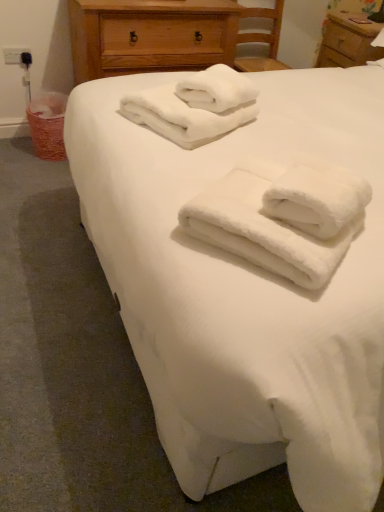
Identify the location of white soft towels at upper center, the first towel when ordered from top to bottom. (183, 117).

Image resolution: width=384 pixels, height=512 pixels. Describe the element at coordinates (17, 56) in the screenshot. I see `black plastic outlet at upper left` at that location.

Describe the element at coordinates (348, 40) in the screenshot. The image size is (384, 512). I see `wooden nightstand at upper right` at that location.

At what (x,y) coordinates should I click in order to perform the action: click on white soft towels at upper center, which appears as the first towel when viewed from the back. Please return your answer as a coordinate pair (x, y). Image resolution: width=384 pixels, height=512 pixels. Looking at the image, I should click on (183, 117).

Based on their positions, is white fluffy towels at center, which ranks as the 1th towel in front-to-back order, located to the left or right of white soft bed at center?

From the image, it's evident that white fluffy towels at center, which ranks as the 1th towel in front-to-back order, is to the left of white soft bed at center.

Is white fluffy towels at center, placed as the 1th towel when sorted from bottom to top, further to the viewer compared to white soft bed at center?

Yes, white fluffy towels at center, placed as the 1th towel when sorted from bottom to top, is further from the camera.

In terms of height, does white fluffy towels at center, which ranks as the second towel in top-to-bottom order, look taller or shorter compared to white soft bed at center?

white fluffy towels at center, which ranks as the second towel in top-to-bottom order, is shorter than white soft bed at center.

The height and width of the screenshot is (512, 384). I want to click on bed located in front of the white fluffy towels at center, placed as the 1th towel when sorted from bottom to top, so click(244, 291).

What's the angular difference between black plastic outlet at upper left and wooden chest of drawers at upper center's facing directions?

1.42 degrees separate the facing orientations of black plastic outlet at upper left and wooden chest of drawers at upper center.

Which is in front, black plastic outlet at upper left or wooden chest of drawers at upper center?

wooden chest of drawers at upper center is in front.

Which is nearer, (6,50) or (222,61)?

Point (6,50) appears to be farther away from the viewer than point (222,61).

Is black plastic outlet at upper left facing towards wooden chest of drawers at upper center?

No, black plastic outlet at upper left is not oriented towards wooden chest of drawers at upper center.

Considering the relative sizes of white fluffy towels at center, which ranks as the second towel in back-to-front order, and black plastic outlet at upper left in the image provided, is white fluffy towels at center, which ranks as the second towel in back-to-front order, bigger than black plastic outlet at upper left?

Yes, white fluffy towels at center, which ranks as the second towel in back-to-front order, is bigger than black plastic outlet at upper left.

Is black plastic outlet at upper left at the back of white fluffy towels at center, which ranks as the 1th towel in front-to-back order?

No, white fluffy towels at center, which ranks as the 1th towel in front-to-back order, is not facing the opposite direction of black plastic outlet at upper left.

From a real-world perspective, is white fluffy towels at center, which ranks as the second towel in top-to-bottom order, beneath black plastic outlet at upper left?

No, from a real-world perspective, white fluffy towels at center, which ranks as the second towel in top-to-bottom order, is not under black plastic outlet at upper left.

Is black plastic outlet at upper left at the left side of white soft towels at upper center, the first towel when ordered from top to bottom?

Yes, black plastic outlet at upper left is to the left of white soft towels at upper center, the first towel when ordered from top to bottom.

Is black plastic outlet at upper left with white soft towels at upper center, which ranks as the 2th towel in front-to-back order?

No, black plastic outlet at upper left is not touching white soft towels at upper center, which ranks as the 2th towel in front-to-back order.

How different are the orientations of black plastic outlet at upper left and white soft towels at upper center, which ranks as the 2th towel in front-to-back order, in degrees?

There is a 63.9-degree angle between the facing directions of black plastic outlet at upper left and white soft towels at upper center, which ranks as the 2th towel in front-to-back order.

Identify the location of electric outlet located on the left of white soft towels at upper center, which appears as the first towel when viewed from the back. Image resolution: width=384 pixels, height=512 pixels. (x=17, y=56).

Would you consider white fluffy towels at center, which ranks as the 1th towel in front-to-back order, to be distant from wooden chest of drawers at upper center?

Yes, white fluffy towels at center, which ranks as the 1th towel in front-to-back order, and wooden chest of drawers at upper center are quite far apart.

Who is taller, white fluffy towels at center, which ranks as the second towel in back-to-front order, or wooden chest of drawers at upper center?

wooden chest of drawers at upper center.

Can you tell me how much white fluffy towels at center, placed as the 1th towel when sorted from bottom to top, and wooden chest of drawers at upper center differ in facing direction?

The facing directions of white fluffy towels at center, placed as the 1th towel when sorted from bottom to top, and wooden chest of drawers at upper center are 53.7 degrees apart.

From a real-world perspective, is white fluffy towels at center, which ranks as the second towel in back-to-front order, located higher than wooden chest of drawers at upper center?

Correct, in the physical world, white fluffy towels at center, which ranks as the second towel in back-to-front order, is higher than wooden chest of drawers at upper center.

Is white soft bed at center beside wooden nightstand at upper right?

No, white soft bed at center is not beside wooden nightstand at upper right.

From a real-world perspective, is white soft bed at center under wooden nightstand at upper right?

Yes, from a real-world perspective, white soft bed at center is below wooden nightstand at upper right.

Looking at this image, which of these two, white soft bed at center or wooden nightstand at upper right, is thinner?

wooden nightstand at upper right is thinner.

From the image's perspective, relative to wooden nightstand at upper right, is white soft bed at center above or below?

white soft bed at center is below wooden nightstand at upper right.

Is the position of wooden chest of drawers at upper center less distant than that of black plastic outlet at upper left?

Yes, wooden chest of drawers at upper center is closer to the viewer.

Which of these two, wooden chest of drawers at upper center or black plastic outlet at upper left, stands taller?

Standing taller between the two is wooden chest of drawers at upper center.

Is black plastic outlet at upper left located within wooden chest of drawers at upper center?

No, black plastic outlet at upper left is not a part of wooden chest of drawers at upper center.

From the image's perspective, does wooden chest of drawers at upper center appear higher than black plastic outlet at upper left?

Correct, wooden chest of drawers at upper center appears higher than black plastic outlet at upper left in the image.

Locate an element on the screen. the 1st towel to the left when counting from the white soft bed at center is located at coordinates (263, 228).

Locate an element on the screen. the chest of drawers above the black plastic outlet at upper left (from a real-world perspective) is located at coordinates (150, 36).

Considering their positions, is white soft towels at upper center, which ranks as the 2th towel in front-to-back order, positioned closer to wooden nightstand at upper right than white soft bed at center?

white soft bed at center lies closer to wooden nightstand at upper right than the other object.

Estimate the real-world distances between objects in this image. Which object is further from white fluffy towels at center, which ranks as the 1th towel in front-to-back order, wooden nightstand at upper right or white soft bed at center?

wooden nightstand at upper right is positioned further to the anchor white fluffy towels at center, which ranks as the 1th towel in front-to-back order.

Estimate the real-world distances between objects in this image. Which object is further from wooden nightstand at upper right, black plastic outlet at upper left or white soft towels at upper center, which appears as the first towel when viewed from the back?

black plastic outlet at upper left is further to wooden nightstand at upper right.

In the scene shown: From the image, which object appears to be farther from white fluffy towels at center, which ranks as the 1th towel in front-to-back order, black plastic outlet at upper left or white soft towels at upper center, which ranks as the 2th towel in front-to-back order?

black plastic outlet at upper left.

Considering their positions, is wooden nightstand at upper right positioned closer to white fluffy towels at center, which ranks as the second towel in top-to-bottom order, than white soft towels at upper center, which appears as the first towel when viewed from the back?

Based on the image, white soft towels at upper center, which appears as the first towel when viewed from the back, appears to be nearer to white fluffy towels at center, which ranks as the second towel in top-to-bottom order.

Based on their spatial positions, is white soft bed at center or wooden nightstand at upper right closer to white fluffy towels at center, placed as the 1th towel when sorted from bottom to top?

Among the two, white soft bed at center is located nearer to white fluffy towels at center, placed as the 1th towel when sorted from bottom to top.

Looking at the image, which one is located further to wooden nightstand at upper right, white fluffy towels at center, which ranks as the second towel in top-to-bottom order, or black plastic outlet at upper left?

white fluffy towels at center, which ranks as the second towel in top-to-bottom order, is positioned further to the anchor wooden nightstand at upper right.

Which object lies nearer to the anchor point white soft towels at upper center, the first towel when ordered from top to bottom, wooden chest of drawers at upper center or white fluffy towels at center, which ranks as the second towel in back-to-front order?

Among the two, white fluffy towels at center, which ranks as the second towel in back-to-front order, is located nearer to white soft towels at upper center, the first towel when ordered from top to bottom.

Find the location of a particular element. This screenshot has height=512, width=384. towel located between white fluffy towels at center, placed as the 1th towel when sorted from bottom to top, and wooden nightstand at upper right in the depth direction is located at coordinates (183, 117).

Locate an element on the screen. The image size is (384, 512). towel between white fluffy towels at center, which ranks as the second towel in top-to-bottom order, and black plastic outlet at upper left, along the z-axis is located at coordinates (183, 117).

The image size is (384, 512). Find the location of `chest of drawers between white fluffy towels at center, which ranks as the 1th towel in front-to-back order, and black plastic outlet at upper left in the front-back direction`. chest of drawers between white fluffy towels at center, which ranks as the 1th towel in front-to-back order, and black plastic outlet at upper left in the front-back direction is located at coordinates (150, 36).

Locate an element on the screen. This screenshot has height=512, width=384. towel between white fluffy towels at center, which ranks as the second towel in top-to-bottom order, and wooden chest of drawers at upper center, along the z-axis is located at coordinates (183, 117).